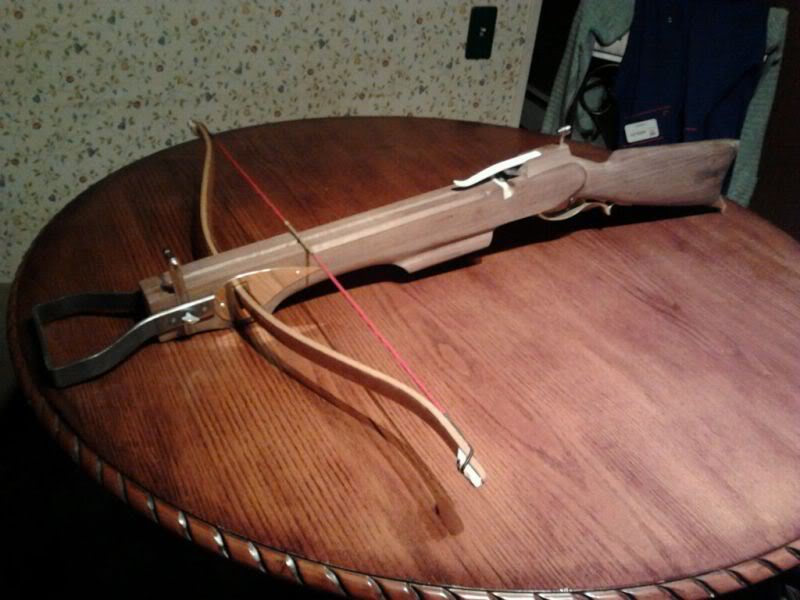
This screenshot has width=800, height=600. What are the coordinates of `wall` in the screenshot? It's located at (245, 68).